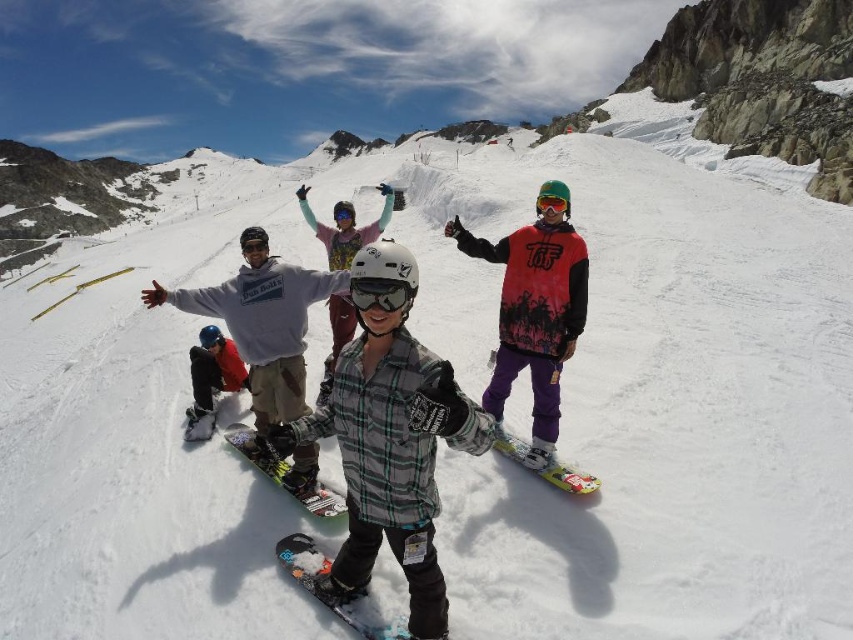
Does brushed metal snowboard at center have a smaller size compared to clear plastic goggles at center?

Actually, brushed metal snowboard at center might be larger than clear plastic goggles at center.

Is brushed metal snowboard at center to the right of clear plastic goggles at center from the viewer's perspective?

In fact, brushed metal snowboard at center is to the left of clear plastic goggles at center.

The width and height of the screenshot is (853, 640). What are the coordinates of `brushed metal snowboard at center` in the screenshot? It's located at (252, 454).

Does brushed metal snowboard at center have a greater width compared to black matte snowboard at lower left?

Correct, the width of brushed metal snowboard at center exceeds that of black matte snowboard at lower left.

This screenshot has height=640, width=853. What do you see at coordinates (252, 454) in the screenshot? I see `brushed metal snowboard at center` at bounding box center [252, 454].

At what (x,y) coordinates should I click in order to perform the action: click on brushed metal snowboard at center. Please return your answer as a coordinate pair (x, y). Looking at the image, I should click on (252, 454).

Which is below, multicolored plastic snowboard at center or clear plastic goggles at center?

multicolored plastic snowboard at center is lower down.

Who is more distant from viewer, (335, 614) or (383, 282)?

Point (383, 282)

This screenshot has height=640, width=853. What do you see at coordinates (326, 573) in the screenshot?
I see `multicolored plastic snowboard at center` at bounding box center [326, 573].

You are a GUI agent. You are given a task and a screenshot of the screen. Output one action in this format:
    pyautogui.click(x=<x>, y=<y>)
    Task: Click on the multicolored plastic snowboard at center
    The width and height of the screenshot is (853, 640).
    Given the screenshot: What is the action you would take?
    pyautogui.click(x=326, y=573)